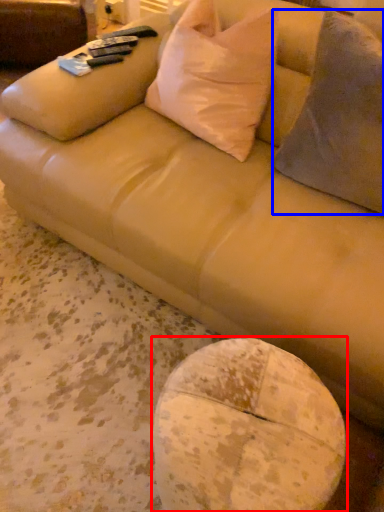
Question: Which point is further to the camera, round table (highlighted by a red box) or throw pillow (highlighted by a blue box)?

Choices:
 (A) round table
 (B) throw pillow

Answer: (B)